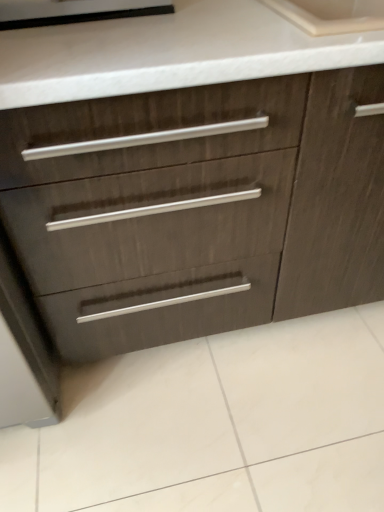
Image resolution: width=384 pixels, height=512 pixels. Describe the element at coordinates (74, 11) in the screenshot. I see `black rubber seal at upper left` at that location.

Where is `black rubber seal at upper left`? The height and width of the screenshot is (512, 384). black rubber seal at upper left is located at coordinates (74, 11).

Describe the element at coordinates (198, 210) in the screenshot. The image size is (384, 512). I see `dark wood cabinet at center` at that location.

At what (x,y) coordinates should I click in order to perform the action: click on dark wood cabinet at center. Please return your answer as a coordinate pair (x, y). The width and height of the screenshot is (384, 512). Looking at the image, I should click on (198, 210).

Image resolution: width=384 pixels, height=512 pixels. I want to click on black rubber seal at upper left, so pyautogui.click(x=74, y=11).

Between dark wood cabinet at center and black rubber seal at upper left, which one appears on the left side from the viewer's perspective?

Positioned to the left is black rubber seal at upper left.

Which is in front, dark wood cabinet at center or black rubber seal at upper left?

Positioned in front is dark wood cabinet at center.

Which is nearer, (237, 213) or (55, 7)?

The point (55, 7) is closer to the camera.

From the image's perspective, which one is positioned lower, dark wood cabinet at center or black rubber seal at upper left?

dark wood cabinet at center appears lower in the image.

From a real-world perspective, is dark wood cabinet at center located beneath black rubber seal at upper left?

Indeed, from a real-world perspective, dark wood cabinet at center is positioned beneath black rubber seal at upper left.

Based on the photo, does dark wood cabinet at center have a lesser width compared to black rubber seal at upper left?

No.

Considering the sizes of objects dark wood cabinet at center and black rubber seal at upper left in the image provided, who is shorter, dark wood cabinet at center or black rubber seal at upper left?

Standing shorter between the two is black rubber seal at upper left.

In terms of size, does dark wood cabinet at center appear bigger or smaller than black rubber seal at upper left?

In the image, dark wood cabinet at center appears to be larger than black rubber seal at upper left.

Is dark wood cabinet at center spatially inside black rubber seal at upper left, or outside of it?

dark wood cabinet at center is not inside black rubber seal at upper left, it's outside.

Is dark wood cabinet at center not close to black rubber seal at upper left?

No, dark wood cabinet at center is in close proximity to black rubber seal at upper left.

Is dark wood cabinet at center facing towards black rubber seal at upper left?

No.

How many degrees apart are the facing directions of dark wood cabinet at center and black rubber seal at upper left?

0.155 degrees.

This screenshot has width=384, height=512. In order to click on appliance that appears on the left of dark wood cabinet at center in this screenshot , I will do `click(74, 11)`.

Visually, is black rubber seal at upper left positioned to the left or to the right of dark wood cabinet at center?

Clearly, black rubber seal at upper left is on the left of dark wood cabinet at center in the image.

Relative to dark wood cabinet at center, is black rubber seal at upper left in front or behind?

In the image, black rubber seal at upper left appears behind dark wood cabinet at center.

Does point (19, 26) appear closer or farther from the camera than point (108, 296)?

Clearly, point (19, 26) is closer to the camera than point (108, 296).

From the image's perspective, which one is positioned higher, black rubber seal at upper left or dark wood cabinet at center?

black rubber seal at upper left is shown above in the image.

From a real-world perspective, is black rubber seal at upper left on dark wood cabinet at center?

Yes, from a real-world perspective, black rubber seal at upper left is on top of dark wood cabinet at center.

Can you confirm if black rubber seal at upper left is wider than dark wood cabinet at center?

In fact, black rubber seal at upper left might be narrower than dark wood cabinet at center.

Can you confirm if black rubber seal at upper left is taller than dark wood cabinet at center?

Incorrect, the height of black rubber seal at upper left is not larger of that of dark wood cabinet at center.

Between black rubber seal at upper left and dark wood cabinet at center, which one has larger size?

dark wood cabinet at center.

Is dark wood cabinet at center surrounded by black rubber seal at upper left?

No, black rubber seal at upper left does not contain dark wood cabinet at center.

In the scene shown: Does black rubber seal at upper left touch dark wood cabinet at center?

No.

Does black rubber seal at upper left turn towards dark wood cabinet at center?

No, black rubber seal at upper left does not turn towards dark wood cabinet at center.

The width and height of the screenshot is (384, 512). I want to click on appliance above the dark wood cabinet at center (from a real-world perspective), so click(x=74, y=11).

The image size is (384, 512). Find the location of `chest of drawers below the black rubber seal at upper left (from the image's perspective)`. chest of drawers below the black rubber seal at upper left (from the image's perspective) is located at coordinates (198, 210).

The width and height of the screenshot is (384, 512). In the image, there is a black rubber seal at upper left. In order to click on the chest of drawers below it (from a real-world perspective) in this screenshot , I will do (198, 210).